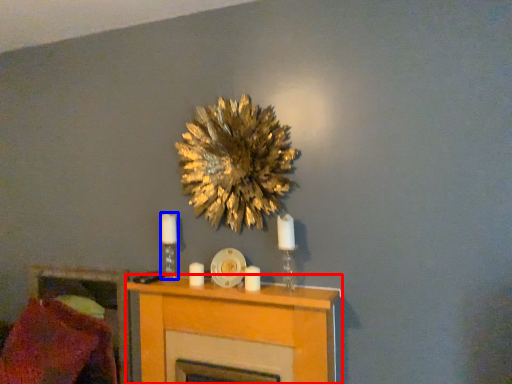
Question: Among these objects, which one is nearest to the camera, furniture (highlighted by a red box) or candle holder (highlighted by a blue box)?

Choices:
 (A) furniture
 (B) candle holder

Answer: (A)